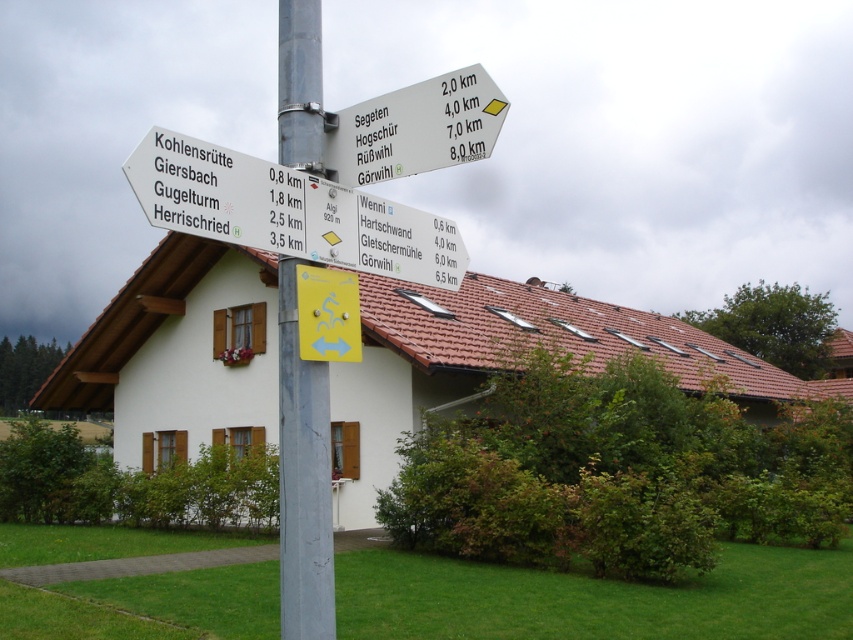
From the picture: Is white plastic sign at upper left above metallic pole at center?

Yes.

Is point (442, 252) in front of point (281, 74)?

No, it is not.

Does point (254, 218) come farther from viewer compared to point (280, 51)?

No, it is in front of (280, 51).

Find the location of `white plastic sign at upper left`. white plastic sign at upper left is located at coordinates (288, 211).

Does white plastic sign at upper left appear over white plastic signpost at upper center?

Actually, white plastic sign at upper left is below white plastic signpost at upper center.

Does white plastic sign at upper left have a larger size compared to white plastic signpost at upper center?

Incorrect, white plastic sign at upper left is not larger than white plastic signpost at upper center.

You are a GUI agent. You are given a task and a screenshot of the screen. Output one action in this format:
    pyautogui.click(x=<x>, y=<y>)
    Task: Click on the white plastic sign at upper left
    
    Given the screenshot: What is the action you would take?
    pyautogui.click(x=288, y=211)

Consider the image. Is metallic pole at center wider than white plastic signpost at upper center?

Incorrect, metallic pole at center's width does not surpass white plastic signpost at upper center's.

How much distance is there between metallic pole at center and white plastic signpost at upper center?

8.21 feet

Identify the location of metallic pole at center. (302, 477).